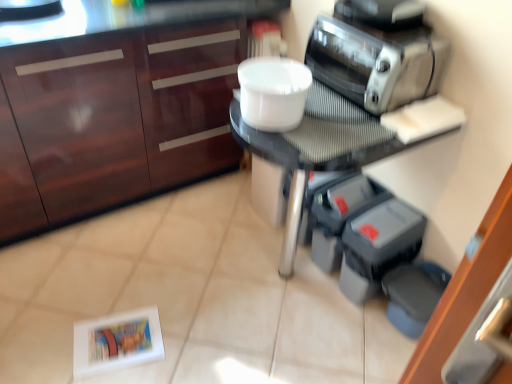
Identify the location of vacant space underneath metallic silver toaster at upper right (from a real-world perspective). (373, 27).